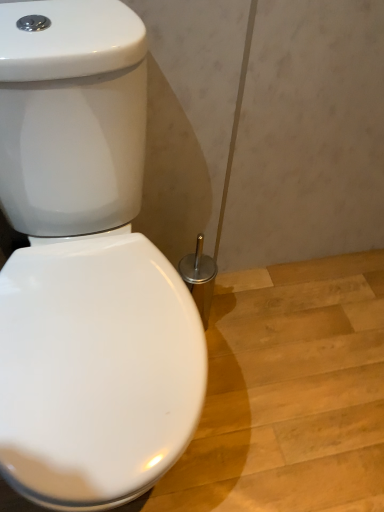
Locate an element on the screen. The height and width of the screenshot is (512, 384). free space above white glossy bidet at lower left (from a real-world perspective) is located at coordinates (284, 372).